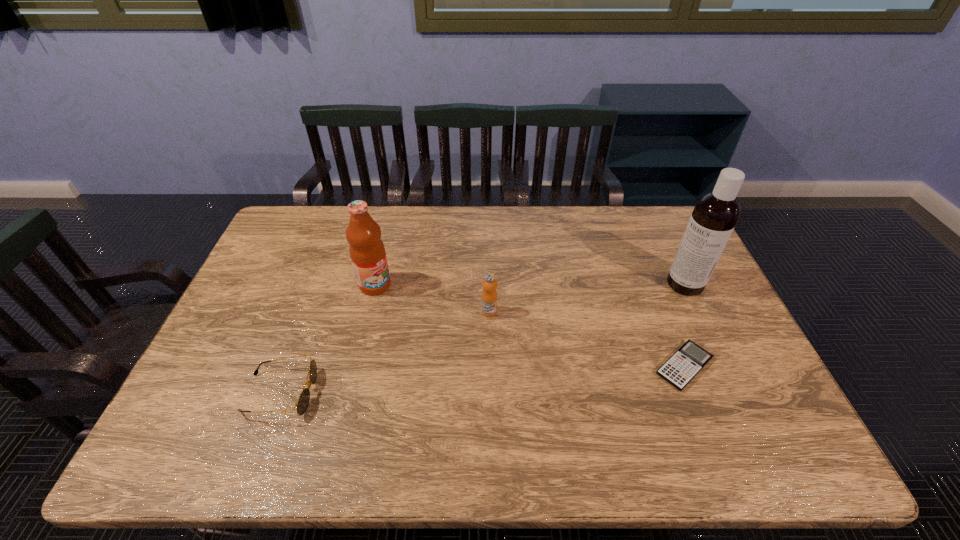
Where is `calculator at the near edge`? The width and height of the screenshot is (960, 540). calculator at the near edge is located at coordinates (690, 359).

Identify the location of object that is positioned at the left edge. The image size is (960, 540). (304, 398).

What are the coordinates of `calculator that is at the right edge` in the screenshot? It's located at (690, 359).

Locate an element on the screen. Image resolution: width=960 pixels, height=540 pixels. dishwasher detergent located at the right edge is located at coordinates (x=715, y=214).

Where is `object present at the near left corner`? Image resolution: width=960 pixels, height=540 pixels. object present at the near left corner is located at coordinates (304, 398).

Where is `object located at the near right corner`? The height and width of the screenshot is (540, 960). object located at the near right corner is located at coordinates (690, 359).

I want to click on free space at the far edge, so click(610, 217).

I want to click on vacant region at the left edge, so click(x=279, y=330).

You are a GUI agent. You are given a task and a screenshot of the screen. Output one action in this format:
    pyautogui.click(x=<x>, y=<y>)
    Task: Click on the free location at the right edge of the desktop
    The image size is (960, 540).
    Given the screenshot: What is the action you would take?
    pyautogui.click(x=732, y=318)

Find the location of `blank area at the far left corner`. blank area at the far left corner is located at coordinates (323, 210).